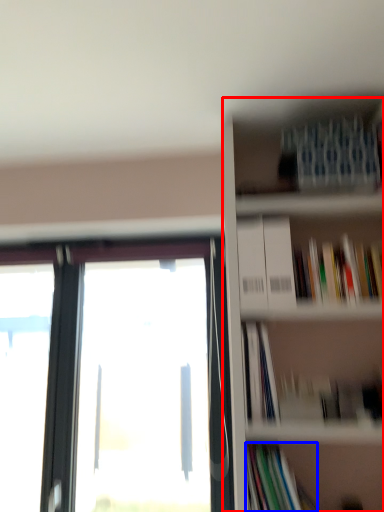
Question: Which of the following is the farthest to the observer, bookcase (highlighted by a red box) or book (highlighted by a blue box)?

Choices:
 (A) bookcase
 (B) book

Answer: (B)